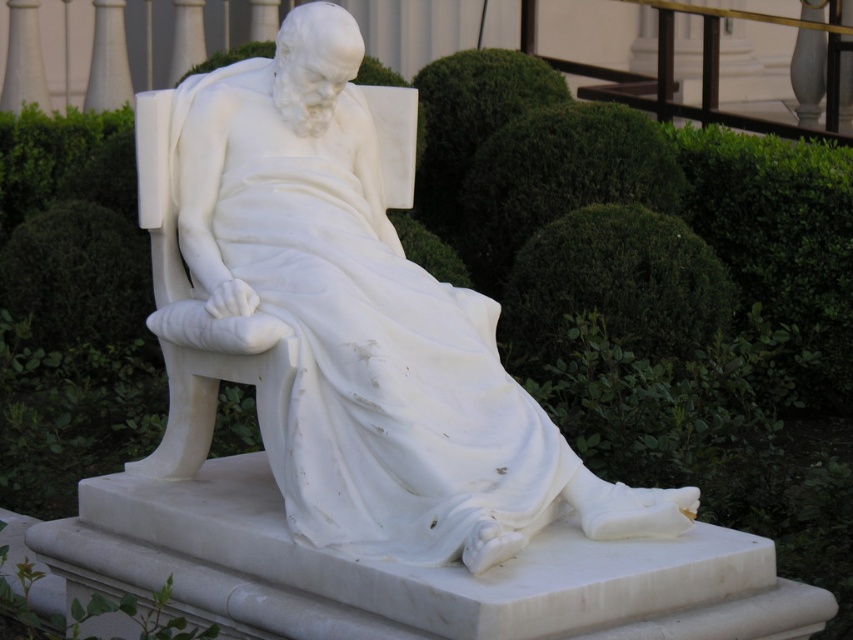
You are a visitor standing in front of the statue. You notice the white marble statue at center and the green leafy bush at center. Which object is positioned higher in the image?

The white marble statue at center is located above the green leafy bush at center, so it is positioned higher in the image.

You are a landscape architect designing a garden pathway. You have to place the white marble statue at center and the green leafy bush at center along the path. Given their sizes, which object should be placed first to ensure proper spacing between them?

The white marble statue at center has a lesser width compared to the green leafy bush at center, so you should place the green leafy bush at center first to allow enough space for both objects along the pathway.

You are standing at the point marked as point (529,477) in the image. The statue is 15 meters tall. Can you see the top of the statue from your current position?

The point (529,477) and camera are 15.45 meters apart. Since the statue is 15 meters tall and you are 15.45 meters away, you can see the top of the statue from your current position.